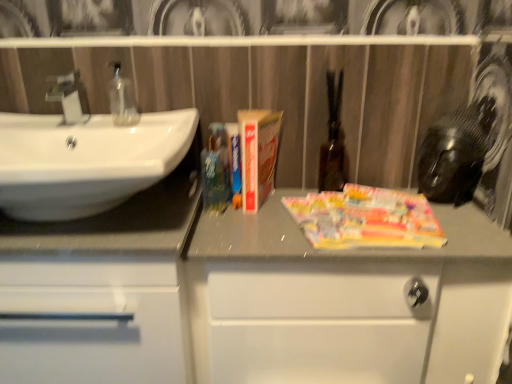
Where is `spots to the right of matte silver faucet at left`? This screenshot has width=512, height=384. spots to the right of matte silver faucet at left is located at coordinates (131, 119).